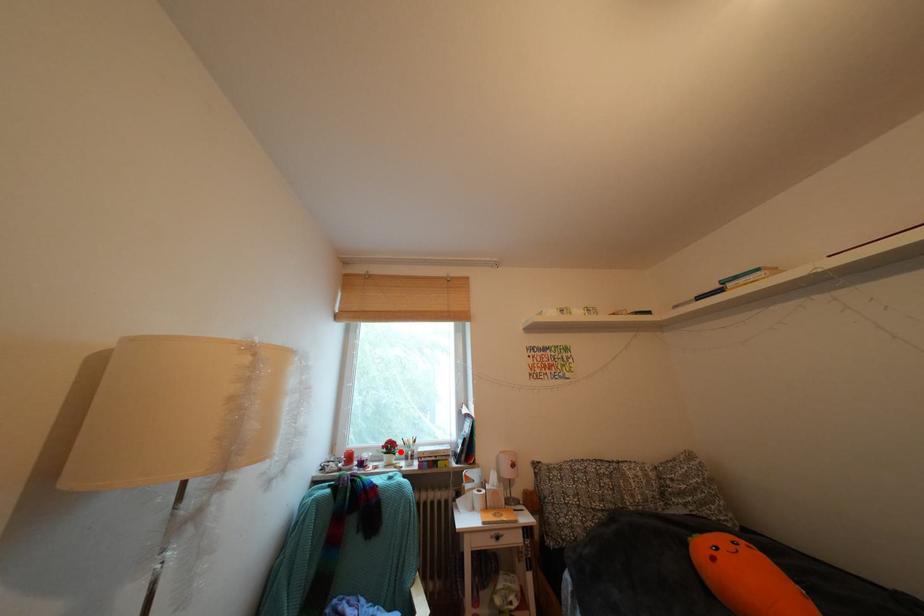
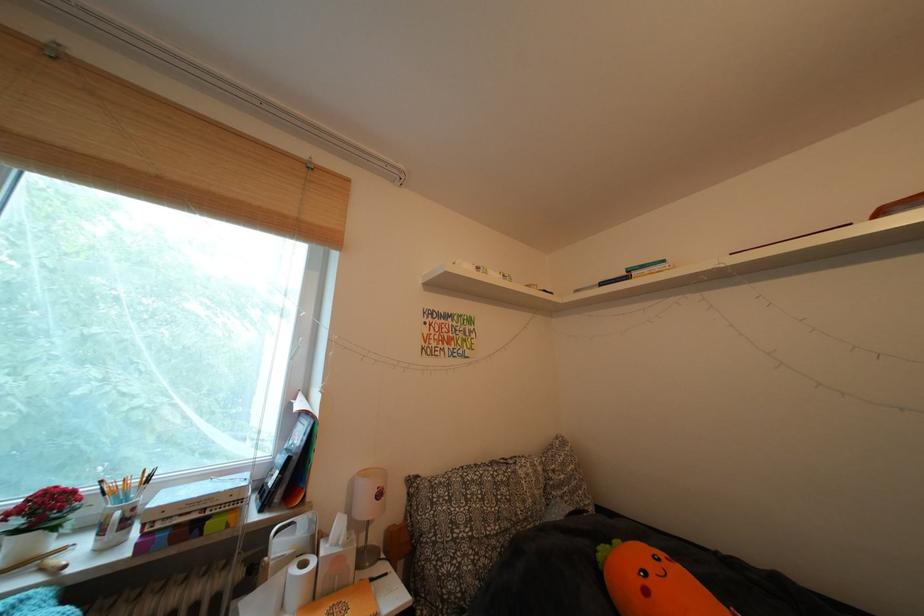
The point at the highlighted location is marked in the first image. Where is the corresponding point in the second image?

(56, 513)